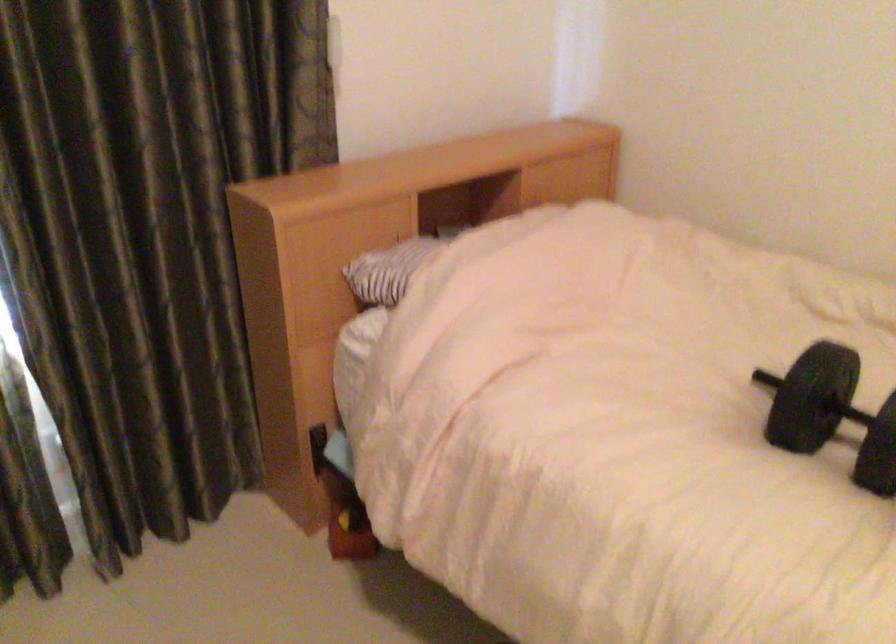
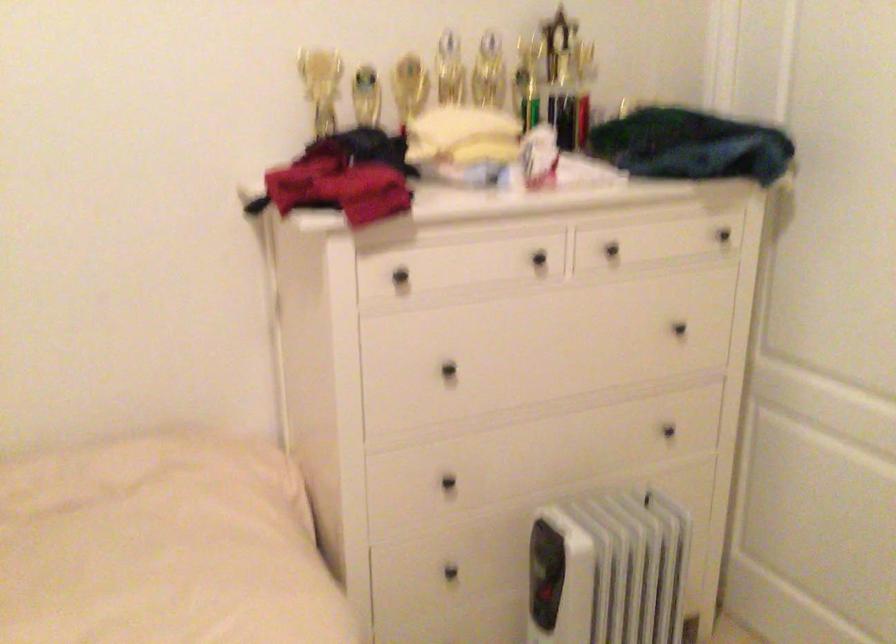
Question: The camera is either moving clockwise (left) or counter-clockwise (right) around the object. The first image is from the beginning of the video and the second image is from the end. Is the camera moving left or right when shooting the video?

Choices:
 (A) Left
 (B) Right

Answer: (A)